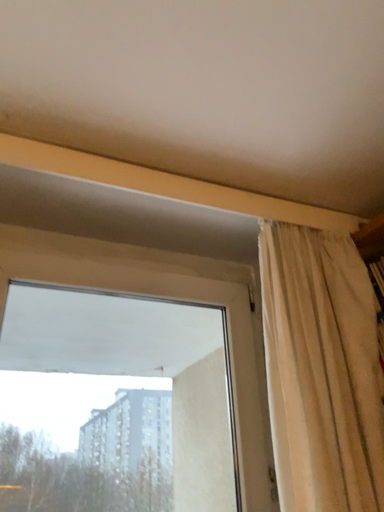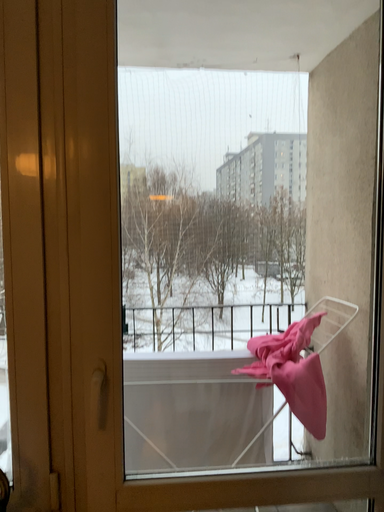
Question: How did the camera likely rotate when shooting the video?

Choices:
 (A) rotated downward
 (B) rotated upward

Answer: (A)